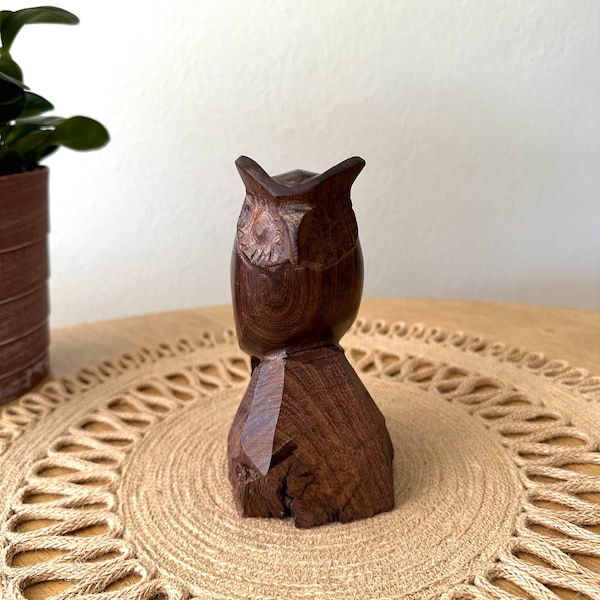
Where is `straw doily`? This screenshot has height=600, width=600. straw doily is located at coordinates (455, 499).